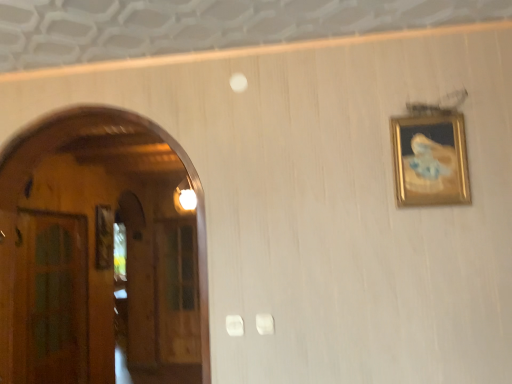
Question: From a real-world perspective, does transparent wooden door at left, acting as the second glass door starting from the left, stand above green glass door at left, which is the 2th glass door in back-to-front order?

Choices:
 (A) no
 (B) yes

Answer: (A)

Question: Is transparent wooden door at left, arranged as the 1th glass door when viewed from the right, taller than green glass door at left, which is the 2th glass door in back-to-front order?

Choices:
 (A) yes
 (B) no

Answer: (A)

Question: Is transparent wooden door at left, arranged as the 1th glass door when viewed from the right, positioned with its back to green glass door at left, positioned as the second glass door in right-to-left order?

Choices:
 (A) no
 (B) yes

Answer: (A)

Question: Does transparent wooden door at left, marked as the 1th glass door in a back-to-front arrangement, lie in front of green glass door at left, placed as the first glass door when sorted from left to right?

Choices:
 (A) no
 (B) yes

Answer: (A)

Question: Can you confirm if transparent wooden door at left, marked as the 1th glass door in a back-to-front arrangement, is positioned to the right of green glass door at left, positioned as the second glass door in right-to-left order?

Choices:
 (A) yes
 (B) no

Answer: (A)

Question: Is transparent wooden door at left, acting as the second glass door starting from the left, thinner than green glass door at left, which is the 2th glass door in back-to-front order?

Choices:
 (A) no
 (B) yes

Answer: (A)

Question: Can you confirm if transparent wooden door at left, arranged as the 1th glass door when viewed from the right, is thinner than gold-framed painting at upper right?

Choices:
 (A) no
 (B) yes

Answer: (A)

Question: Is transparent wooden door at left, acting as the second glass door starting from the left, located outside gold-framed painting at upper right?

Choices:
 (A) yes
 (B) no

Answer: (A)

Question: Is transparent wooden door at left, the second glass door in the front-to-back sequence, beside gold-framed painting at upper right?

Choices:
 (A) no
 (B) yes

Answer: (A)

Question: Is transparent wooden door at left, acting as the second glass door starting from the left, looking in the opposite direction of gold-framed painting at upper right?

Choices:
 (A) no
 (B) yes

Answer: (A)

Question: Does transparent wooden door at left, arranged as the 1th glass door when viewed from the right, have a greater height compared to gold-framed painting at upper right?

Choices:
 (A) yes
 (B) no

Answer: (A)

Question: Can gold-framed painting at upper right be found inside transparent wooden door at left, the second glass door in the front-to-back sequence?

Choices:
 (A) yes
 (B) no

Answer: (B)

Question: Is green glass door at left, positioned as the second glass door in right-to-left order, aimed at gold-framed painting at upper right?

Choices:
 (A) yes
 (B) no

Answer: (B)